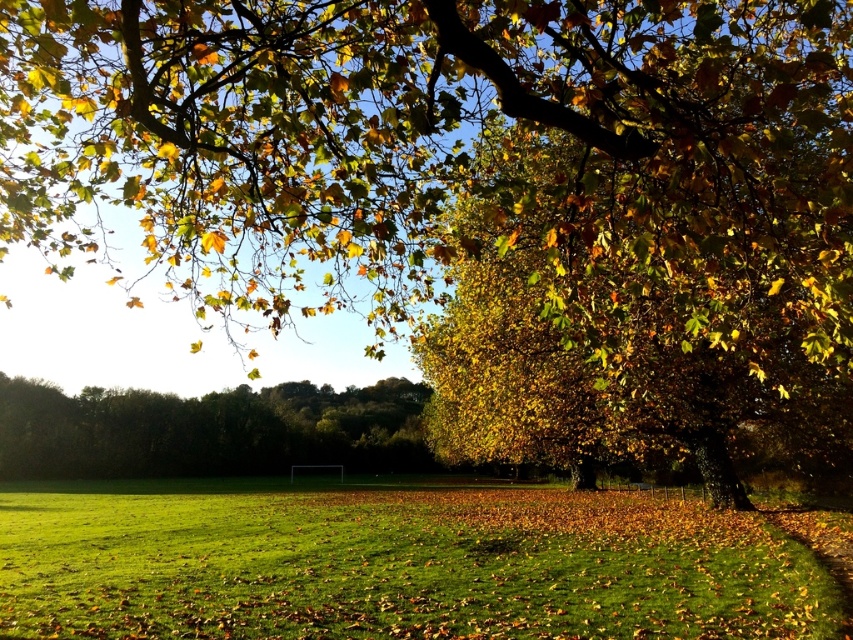
Does point (726, 550) lie in front of point (173, 460)?

Yes, point (726, 550) is closer to viewer.

Where is `green grassy field at center`? The image size is (853, 640). green grassy field at center is located at coordinates (401, 566).

Locate an element on the screen. green grassy field at center is located at coordinates (401, 566).

Where is `green grassy field at center`? The image size is (853, 640). green grassy field at center is located at coordinates (401, 566).